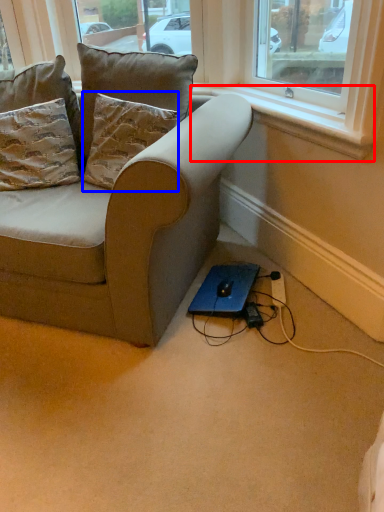
Question: Which object appears closest to the camera in this image, window sill (highlighted by a red box) or pillow (highlighted by a blue box)?

Choices:
 (A) window sill
 (B) pillow

Answer: (A)